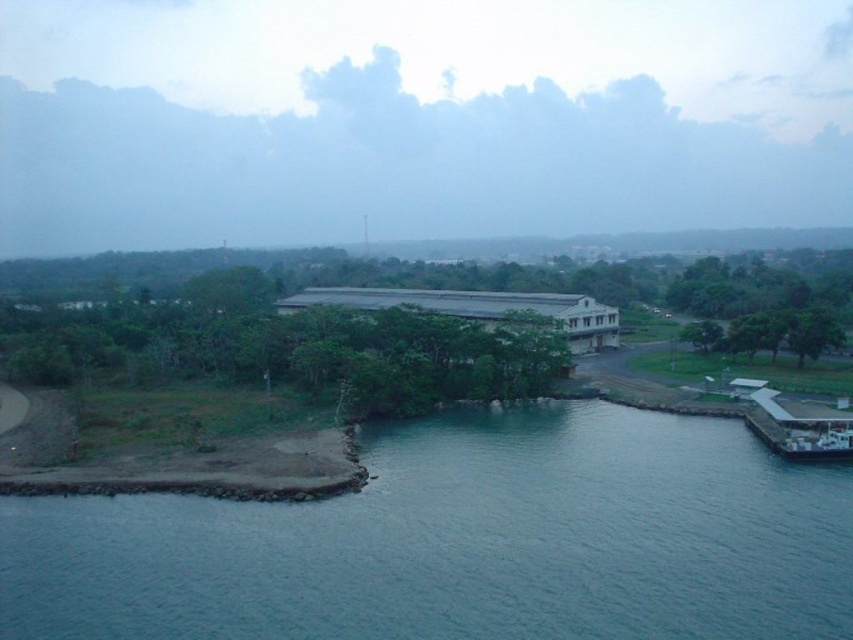
You are standing at the point marked by the coordinates point (462, 541) in the coastal scene. Looking around, you notice blue water at lower left. Which direction would you face to see the large building in the middle ground?

Since the point (462, 541) indicates blue water at lower left, facing away from the water towards the opposite direction would allow you to see the large building in the middle ground.

You are a photographer planning to capture the entire view of the blue water at lower left and the white glossy ferry at lower right in a single frame. Based on the scene description, which object should you position closer to the edge of your camera frame to ensure both are fully visible?

To ensure both the blue water at lower left and the white glossy ferry at lower right are fully visible in a single frame, you should position the white glossy ferry at lower right closer to the edge of your camera frame since the blue water at lower left might be wider than the white glossy ferry at lower right.